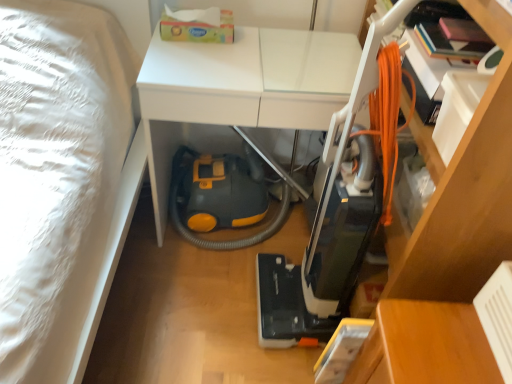
Image resolution: width=512 pixels, height=384 pixels. Identify the location of free location in front of white glossy table at center, placed as the 1th table when sorted from top to bottom. (194, 314).